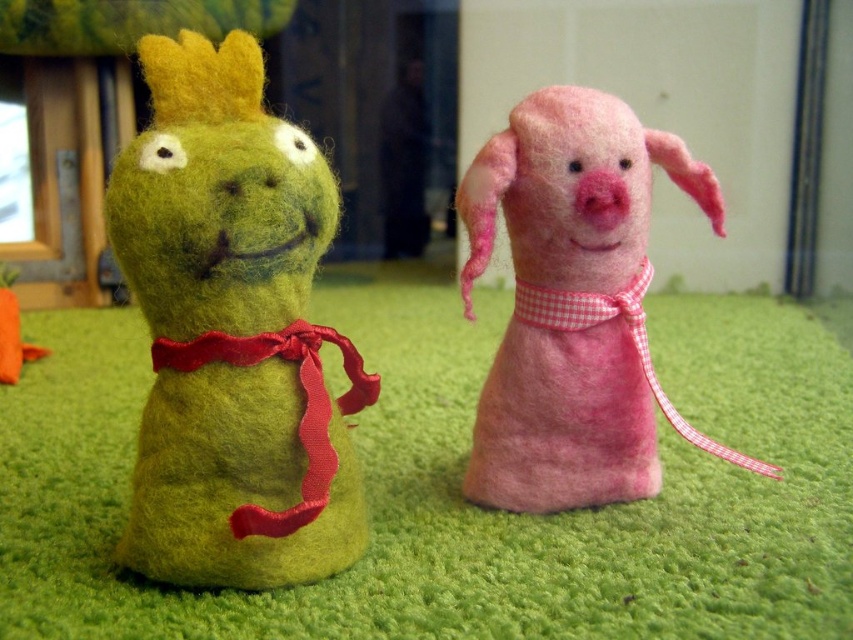
Can you confirm if pink felt piglet at center is positioned to the right of pink felt apron at center?

Indeed, pink felt piglet at center is positioned on the right side of pink felt apron at center.

Is pink felt piglet at center thinner than pink felt apron at center?

No, pink felt piglet at center is not thinner than pink felt apron at center.

Between point (631, 406) and point (520, 339), which one is positioned in front?

Point (520, 339) is in front.

Image resolution: width=853 pixels, height=640 pixels. I want to click on pink felt piglet at center, so coord(573,304).

Can you confirm if green felt grass at center is wider than pink felt piglet at center?

Yes.

Between point (50, 598) and point (482, 224), which one is positioned behind?

The point (482, 224) is behind.

Does point (117, 452) come closer to viewer compared to point (534, 435)?

No, it is not.

Locate an element on the screen. green felt grass at center is located at coordinates (459, 490).

Is point (16, 451) behind point (465, 490)?

That is True.

Does green felt grass at center appear over pink felt apron at center?

Indeed, green felt grass at center is positioned over pink felt apron at center.

The width and height of the screenshot is (853, 640). Identify the location of green felt grass at center. pos(459,490).

This screenshot has width=853, height=640. I want to click on green felt grass at center, so click(x=459, y=490).